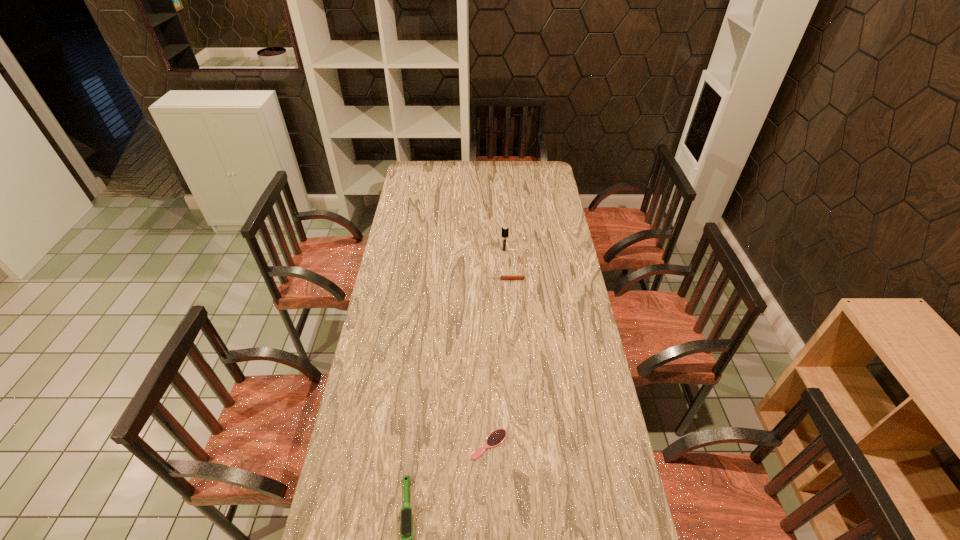
Find the location of a particular element. The width and height of the screenshot is (960, 540). the tallest hairbrush is located at coordinates 505,230.

This screenshot has width=960, height=540. I want to click on the farthest hairbrush, so click(505, 230).

At what (x,y) coordinates should I click in order to perform the action: click on sausage. Please return your answer as a coordinate pair (x, y). The image size is (960, 540). Looking at the image, I should click on (504, 277).

Find the location of a particular element. the second farthest object is located at coordinates (504, 277).

Locate an element on the screen. The width and height of the screenshot is (960, 540). the second farthest hairbrush is located at coordinates (497, 437).

The height and width of the screenshot is (540, 960). Find the location of `the shortest object`. the shortest object is located at coordinates (497, 437).

The height and width of the screenshot is (540, 960). I want to click on vacant position located on the front of the tallest hairbrush, so click(x=507, y=296).

The image size is (960, 540). I want to click on vacant region located on the front of the third tallest object, so click(x=507, y=291).

I want to click on vacant space situated 0.100m on the right of the third farthest object, so click(539, 444).

The height and width of the screenshot is (540, 960). In the image, there is a desktop. Find the location of `free space at the far edge`. free space at the far edge is located at coordinates (512, 181).